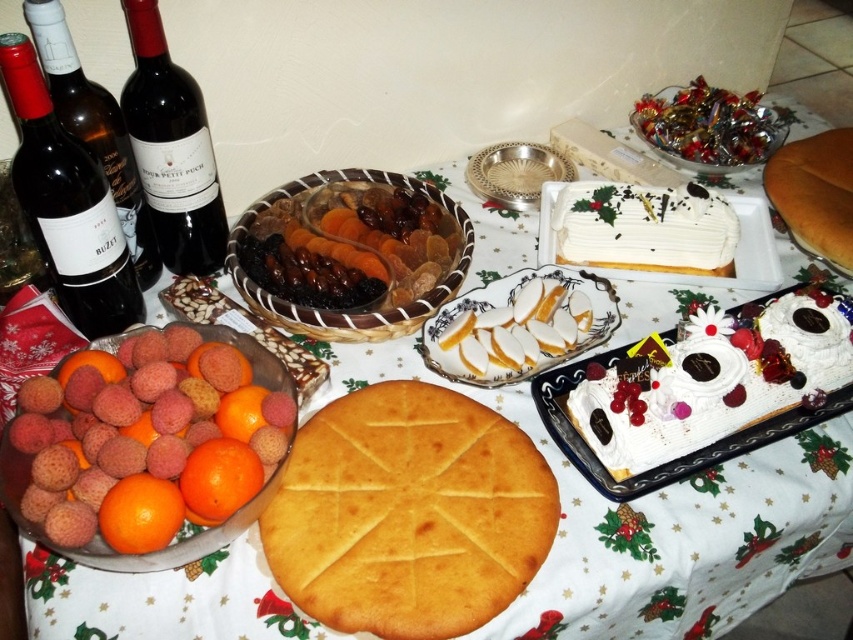
Consider the image. You are a guest at a Christmas party and want to reach for the white cream cake at lower right. Which direction should you move from your current position at point (717, 387)?

The white cream cake at lower right is located at point (717, 387), so you are already at the correct position to reach it.

You are a guest at a Christmas dinner and want to place a small plate between the golden brown crust at center and the pink matte lychees at lower left. Which object should you place the plate closer to if you want the plate to be closer to the wider object?

The golden brown crust at center is wider than the pink matte lychees at lower left, so you should place the plate closer to the golden brown crust at center.